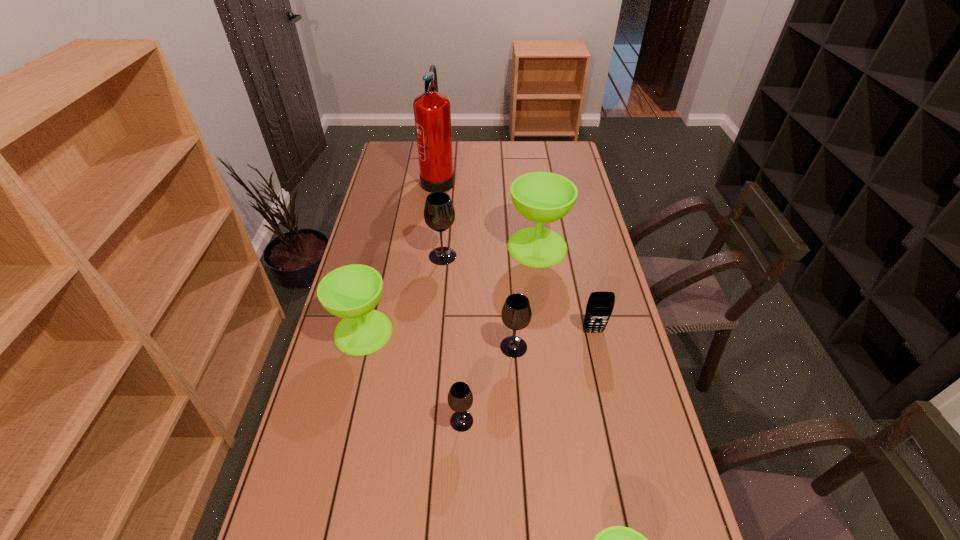
Where is `fire extinguisher`? fire extinguisher is located at coordinates (432, 114).

Locate an element on the screen. The image size is (960, 540). the farthest object is located at coordinates (432, 114).

The image size is (960, 540). Identify the location of the second wineglass from left to right. (439, 214).

Where is `the leftmost gray wineglass`? This screenshot has height=540, width=960. the leftmost gray wineglass is located at coordinates (439, 214).

Where is `the farthest green wineglass`? The image size is (960, 540). the farthest green wineglass is located at coordinates (542, 197).

This screenshot has height=540, width=960. What are the coordinates of `the second nearest gray wineglass` in the screenshot? It's located at (516, 314).

Locate an element on the screen. This screenshot has height=540, width=960. the rightmost gray wineglass is located at coordinates (516, 314).

Find the location of a particular element. the second farthest green wineglass is located at coordinates 351,292.

The image size is (960, 540). I want to click on the second biggest green wineglass, so click(351, 292).

At what (x,y) coordinates should I click in order to perform the action: click on cellular telephone. Please return your answer as a coordinate pair (x, y). Looking at the image, I should click on (600, 305).